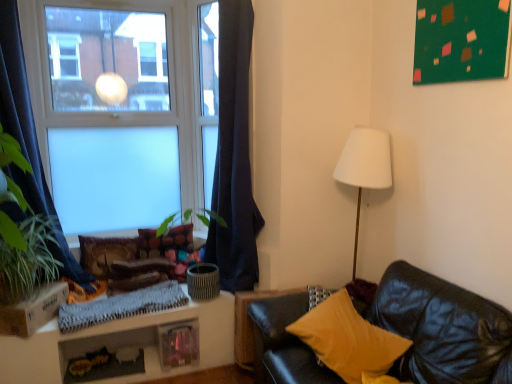
What is the approximate height of yellow fabric pillow at lower right, the 1th pillow in the right-to-left sequence?

yellow fabric pillow at lower right, the 1th pillow in the right-to-left sequence, is 9.57 inches in height.

In order to face velvet textured pillow at center, marked as the 3th pillow in a front-to-back arrangement, should I rotate leftwards or rightwards?

Turn left by 11.730 degrees to look at velvet textured pillow at center, marked as the 3th pillow in a front-to-back arrangement.

The width and height of the screenshot is (512, 384). Describe the element at coordinates (166, 238) in the screenshot. I see `velvet textured pillow at center, acting as the 2th pillow starting from the left` at that location.

Describe the element at coordinates (123, 108) in the screenshot. I see `matte glass window at upper left` at that location.

Where is `yellow fabric pillow at lower right, which ranks as the third pillow in left-to-right order`? The height and width of the screenshot is (384, 512). yellow fabric pillow at lower right, which ranks as the third pillow in left-to-right order is located at coordinates (348, 340).

Is velvet textured pillow at center, the 2th pillow positioned from the right, outside of translucent glass jar at lower center?

velvet textured pillow at center, the 2th pillow positioned from the right, is positioned outside translucent glass jar at lower center.

Is velvet textured pillow at center, which is the 1th pillow from back to front, far away from translucent glass jar at lower center?

No, velvet textured pillow at center, which is the 1th pillow from back to front, is not far away from translucent glass jar at lower center.

Would you say velvet textured pillow at center, acting as the 2th pillow starting from the left, is to the left or to the right of translucent glass jar at lower center in the picture?

Based on their positions, velvet textured pillow at center, acting as the 2th pillow starting from the left, is located to the right of translucent glass jar at lower center.

Is matte glass window at upper left located within translucent glass jar at lower center?

No.

Looking at this image, which of these two, translucent glass jar at lower center or matte glass window at upper left, is wider?

With larger width is translucent glass jar at lower center.

How distant is dark blue fabric curtain at left, the 2th curtain in the right-to-left sequence, from dark blue fabric curtain at left, the 1th curtain from the right?

3.64 feet.

Is there a large distance between dark blue fabric curtain at left, which is the 1th curtain from left to right, and dark blue fabric curtain at left, arranged as the second curtain when viewed from the left?

Indeed, dark blue fabric curtain at left, which is the 1th curtain from left to right, is not near dark blue fabric curtain at left, arranged as the second curtain when viewed from the left.

From the image's perspective, between dark blue fabric curtain at left, the 2th curtain in the right-to-left sequence, and dark blue fabric curtain at left, the 1th curtain from the right, who is located below?

dark blue fabric curtain at left, the 2th curtain in the right-to-left sequence, appears lower in the image.

Relative to dark blue fabric curtain at left, arranged as the second curtain when viewed from the left, is dark blue fabric curtain at left, which is the 1th curtain from left to right, in front or behind?

Clearly, dark blue fabric curtain at left, which is the 1th curtain from left to right, is in front of dark blue fabric curtain at left, arranged as the second curtain when viewed from the left.

Between translucent glass jar at lower center and velvet textured pillow at center, marked as the 3th pillow in a front-to-back arrangement, which one has less height?

translucent glass jar at lower center is shorter.

Is translucent glass jar at lower center oriented towards velvet textured pillow at center, which is the 1th pillow from back to front?

No, translucent glass jar at lower center is not oriented towards velvet textured pillow at center, which is the 1th pillow from back to front.

From the image's perspective, which one is positioned lower, translucent glass jar at lower center or velvet textured pillow at center, acting as the 2th pillow starting from the left?

translucent glass jar at lower center is shown below in the image.

Based on the photo, does translucent glass jar at lower center touch velvet textured pillow at center, marked as the 3th pillow in a front-to-back arrangement?

No.

In the scene shown: Measure the distance between dark blue fabric curtain at left, the 2th curtain in the right-to-left sequence, and velvet textured pillow at center, the 2th pillow positioned from the right.

A distance of 31.00 inches exists between dark blue fabric curtain at left, the 2th curtain in the right-to-left sequence, and velvet textured pillow at center, the 2th pillow positioned from the right.

Is dark blue fabric curtain at left, the 2th curtain in the right-to-left sequence, looking in the opposite direction of velvet textured pillow at center, acting as the 2th pillow starting from the left?

That's not correct — dark blue fabric curtain at left, the 2th curtain in the right-to-left sequence, is not looking away from velvet textured pillow at center, acting as the 2th pillow starting from the left.

Does dark blue fabric curtain at left, which is the 1th curtain from left to right, come behind velvet textured pillow at center, the 2th pillow positioned from the right?

That is False.

Is dark blue fabric curtain at left, which is the 1th curtain from left to right, wider or thinner than velvet textured pillow at center, which is the 1th pillow from back to front?

Clearly, dark blue fabric curtain at left, which is the 1th curtain from left to right, has more width compared to velvet textured pillow at center, which is the 1th pillow from back to front.

Is yellow fabric pillow at lower right, which is counted as the 3th pillow, starting from the back, located outside dark blue fabric curtain at left, the 1th curtain from the right?

Yes.

Can you confirm if yellow fabric pillow at lower right, the 1th pillow in the right-to-left sequence, is thinner than dark blue fabric curtain at left, arranged as the second curtain when viewed from the left?

Incorrect, the width of yellow fabric pillow at lower right, the 1th pillow in the right-to-left sequence, is not less than that of dark blue fabric curtain at left, arranged as the second curtain when viewed from the left.

From their relative heights in the image, would you say yellow fabric pillow at lower right, the 1th pillow in the front-to-back sequence, is taller or shorter than dark blue fabric curtain at left, the 1th curtain from the right?

Considering their sizes, yellow fabric pillow at lower right, the 1th pillow in the front-to-back sequence, has less height than dark blue fabric curtain at left, the 1th curtain from the right.

How distant is yellow fabric pillow at lower right, which is counted as the 3th pillow, starting from the back, from dark blue fabric curtain at left, the 1th curtain from the right?

The distance of yellow fabric pillow at lower right, which is counted as the 3th pillow, starting from the back, from dark blue fabric curtain at left, the 1th curtain from the right, is 36.24 inches.

From the image's perspective, is textured brown pillow at lower left, arranged as the 1th pillow when viewed from the left, located above or below green leafy plant at left?

textured brown pillow at lower left, arranged as the 1th pillow when viewed from the left, is below green leafy plant at left.

Is textured brown pillow at lower left, the 3th pillow positioned from the right, not close to green leafy plant at left?

No, textured brown pillow at lower left, the 3th pillow positioned from the right, is in close proximity to green leafy plant at left.

Is textured brown pillow at lower left, arranged as the 1th pillow when viewed from the left, to the left of green leafy plant at left from the viewer's perspective?

No, textured brown pillow at lower left, arranged as the 1th pillow when viewed from the left, is not to the left of green leafy plant at left.

This screenshot has width=512, height=384. What are the coordinates of `the 3rd pillow above when counting from the translucent glass jar at lower center (from the image's perspective)` in the screenshot? It's located at pyautogui.click(x=166, y=238).

Find the location of a particular element. window above the translucent glass jar at lower center (from a real-world perspective) is located at coordinates (123, 108).

Which object lies further to the anchor point dark blue fabric curtain at left, the 1th curtain from the right, velvet textured pillow at center, marked as the 3th pillow in a front-to-back arrangement, or textured brown pillow at lower left, arranged as the 1th pillow when viewed from the left?

The object further to dark blue fabric curtain at left, the 1th curtain from the right, is textured brown pillow at lower left, arranged as the 1th pillow when viewed from the left.

Looking at the image, which one is located closer to dark blue fabric curtain at left, the 1th curtain from the right, yellow fabric pillow at lower right, which ranks as the third pillow in left-to-right order, or white knitted blanket at lower left?

Among the two, white knitted blanket at lower left is located nearer to dark blue fabric curtain at left, the 1th curtain from the right.

Based on the photo, which object lies nearer to the anchor point yellow fabric pillow at lower right, which is counted as the 3th pillow, starting from the back, textured brown pillow at lower left, the 3th pillow positioned from the right, or dark blue fabric curtain at left, the 2th curtain in the right-to-left sequence?

Among the two, textured brown pillow at lower left, the 3th pillow positioned from the right, is located nearer to yellow fabric pillow at lower right, which is counted as the 3th pillow, starting from the back.

Based on their spatial positions, is matte glass window at upper left or green leafy plant at left closer to dark blue fabric curtain at left, the 1th curtain from the right?

Based on the image, matte glass window at upper left appears to be nearer to dark blue fabric curtain at left, the 1th curtain from the right.

Considering their positions, is textured brown pillow at lower left, positioned as the second pillow in back-to-front order, positioned closer to translucent glass jar at lower center than yellow fabric pillow at lower right, which is counted as the 3th pillow, starting from the back?

textured brown pillow at lower left, positioned as the second pillow in back-to-front order.

Based on their spatial positions, is dark blue fabric curtain at left, which is the 1th curtain from left to right, or yellow fabric pillow at lower right, the 1th pillow in the right-to-left sequence, closer to dark blue fabric curtain at left, arranged as the second curtain when viewed from the left?

yellow fabric pillow at lower right, the 1th pillow in the right-to-left sequence.

Which object lies nearer to the anchor point white knitted blanket at lower left, velvet textured pillow at center, marked as the 3th pillow in a front-to-back arrangement, or yellow fabric pillow at lower right, the 1th pillow in the right-to-left sequence?

The object closer to white knitted blanket at lower left is velvet textured pillow at center, marked as the 3th pillow in a front-to-back arrangement.

Considering their positions, is white knitted blanket at lower left positioned closer to yellow fabric pillow at lower right, which is counted as the 3th pillow, starting from the back, than dark blue fabric curtain at left, the 1th curtain from the right?

Among the two, dark blue fabric curtain at left, the 1th curtain from the right, is located nearer to yellow fabric pillow at lower right, which is counted as the 3th pillow, starting from the back.

I want to click on blanket between textured brown pillow at lower left, the 3th pillow positioned from the right, and yellow fabric pillow at lower right, which ranks as the third pillow in left-to-right order, from left to right, so click(x=121, y=306).

What are the coordinates of `plant that lies between dark blue fabric curtain at left, which is the 1th curtain from left to right, and white knitted blanket at lower left from top to bottom` in the screenshot? It's located at (27, 260).

Locate an element on the screen. curtain located between dark blue fabric curtain at left, the 2th curtain in the right-to-left sequence, and yellow fabric pillow at lower right, the 1th pillow in the front-to-back sequence, in the left-right direction is located at coordinates (234, 156).

This screenshot has width=512, height=384. I want to click on blanket that lies between dark blue fabric curtain at left, which is the 1th curtain from left to right, and translucent glass jar at lower center from top to bottom, so click(121, 306).